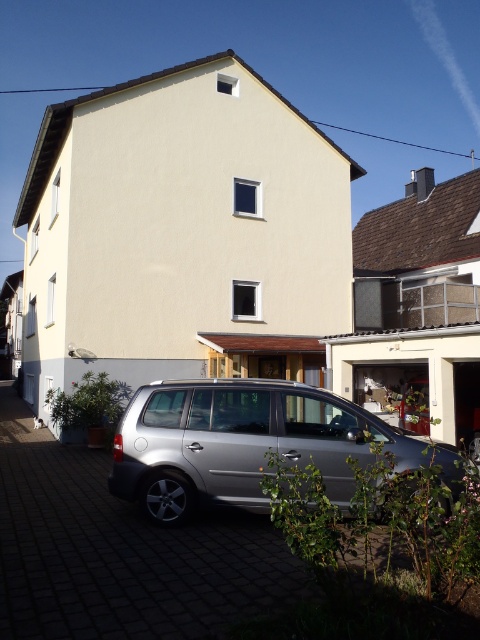
Question: Does silver metallic car at lower center have a lesser width compared to satin silver van at lower center?

Choices:
 (A) no
 (B) yes

Answer: (A)

Question: In this image, where is silver metallic car at lower center located relative to satin silver van at lower center?

Choices:
 (A) below
 (B) above

Answer: (A)

Question: Considering the relative positions of silver metallic car at lower center and satin silver van at lower center in the image provided, where is silver metallic car at lower center located with respect to satin silver van at lower center?

Choices:
 (A) below
 (B) above

Answer: (A)

Question: Which object is closer to the camera taking this photo?

Choices:
 (A) satin silver van at lower center
 (B) silver metallic car at lower center

Answer: (B)

Question: Which point is closer to the camera?

Choices:
 (A) satin silver van at lower center
 (B) silver metallic car at lower center

Answer: (B)